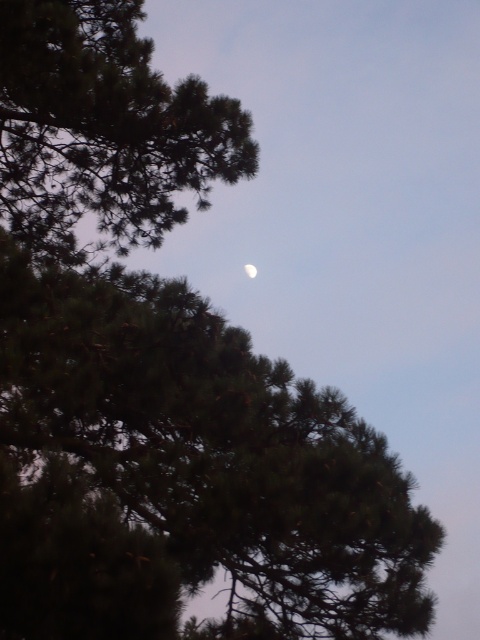
Question: Is green needle-like leaves at upper left positioned in front of green matte tree at upper left?

Choices:
 (A) yes
 (B) no

Answer: (A)

Question: Which of the following is the closest to the observer?

Choices:
 (A) green matte tree at upper left
 (B) white glossy moon at upper center

Answer: (A)

Question: Which point is farther to the camera?

Choices:
 (A) (397, 534)
 (B) (253, 268)

Answer: (B)

Question: Estimate the real-world distances between objects in this image. Which object is farther from the green matte tree at upper left?

Choices:
 (A) green needle-like leaves at upper left
 (B) white glossy moon at upper center

Answer: (B)

Question: Is green matte tree at upper left thinner than white glossy moon at upper center?

Choices:
 (A) no
 (B) yes

Answer: (A)

Question: From the image, what is the correct spatial relationship of green needle-like leaves at upper left in relation to white glossy moon at upper center?

Choices:
 (A) below
 (B) above

Answer: (A)